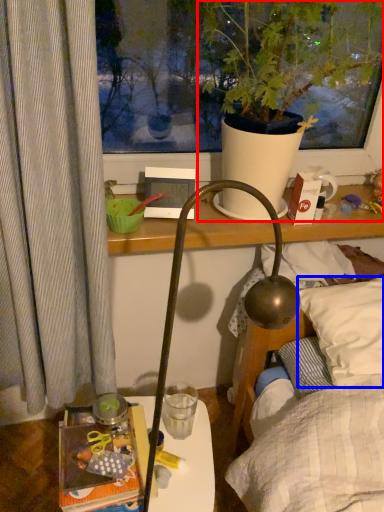
Question: Among these objects, which one is nearest to the camera, houseplant (highlighted by a red box) or pillow (highlighted by a blue box)?

Choices:
 (A) houseplant
 (B) pillow

Answer: (A)